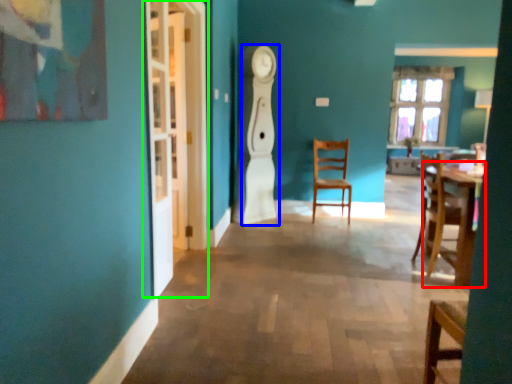
Question: Estimate the real-world distances between objects in this image. Which object is closer to table (highlighted by a red box), wide (highlighted by a blue box) or glass door (highlighted by a green box)?

Choices:
 (A) wide
 (B) glass door

Answer: (A)